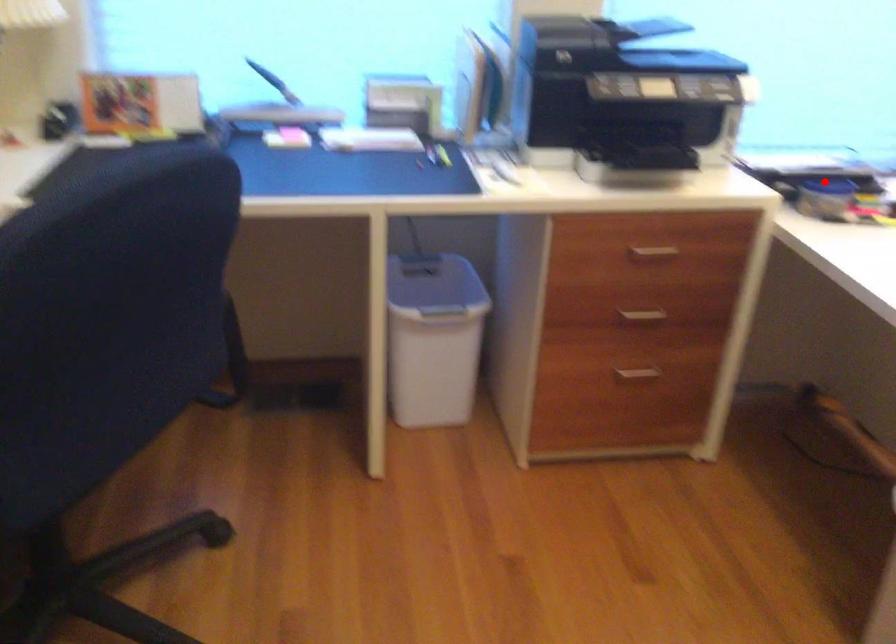
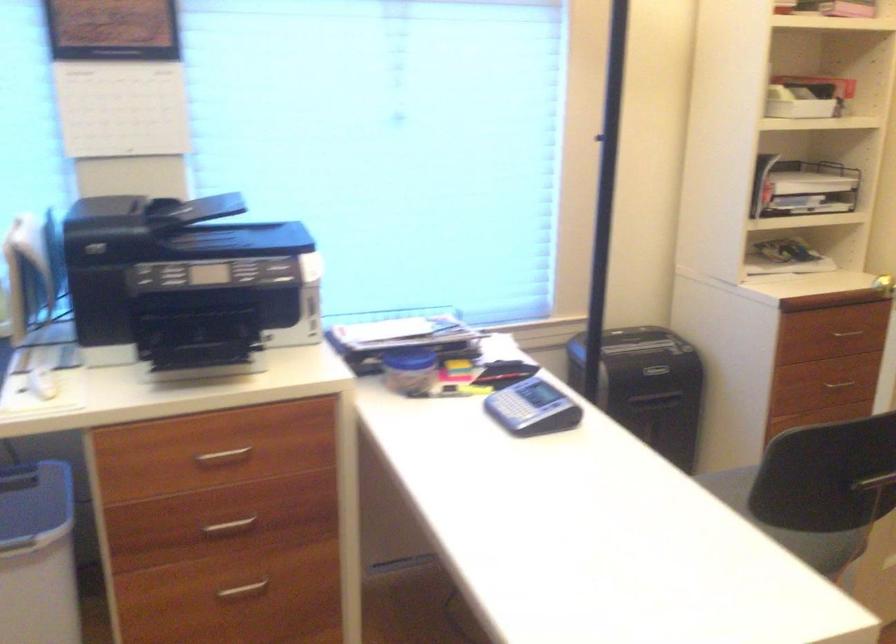
Where in the second image is the point corresponding to the highlighted location from the first image?

(409, 359)